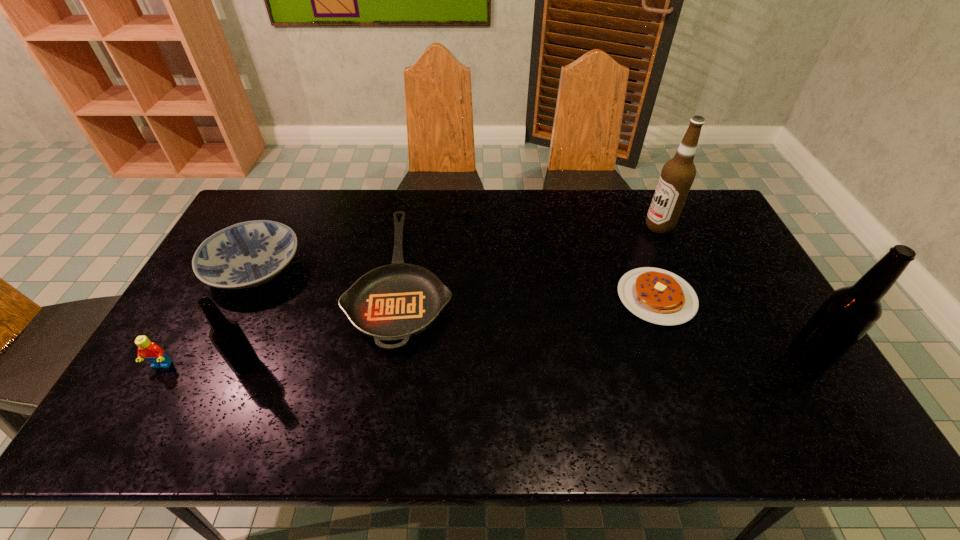
Where is `the third tallest object`? the third tallest object is located at coordinates (227, 336).

Find the location of a particular element. The height and width of the screenshot is (540, 960). the shorter beer bottle is located at coordinates (227, 336).

What are the coordinates of `the rightmost object` in the screenshot? It's located at (849, 312).

Where is `the taller beer bottle`? This screenshot has width=960, height=540. the taller beer bottle is located at coordinates (x=849, y=312).

The width and height of the screenshot is (960, 540). I want to click on the fourth object from right to left, so click(x=394, y=302).

Image resolution: width=960 pixels, height=540 pixels. In order to click on alcohol in this screenshot , I will do `click(677, 176)`.

This screenshot has height=540, width=960. I want to click on pancake, so tap(658, 296).

At what (x,y) coordinates should I click in order to perform the action: click on the fifth tallest object. Please return your answer as a coordinate pair (x, y). Looking at the image, I should click on (248, 254).

At what (x,y) coordinates should I click in order to perform the action: click on the fourth shortest object. Please return your answer as a coordinate pair (x, y). This screenshot has height=540, width=960. Looking at the image, I should click on (148, 350).

Locate an element on the screen. free region located 0.220m on the back of the left beer bottle is located at coordinates (278, 292).